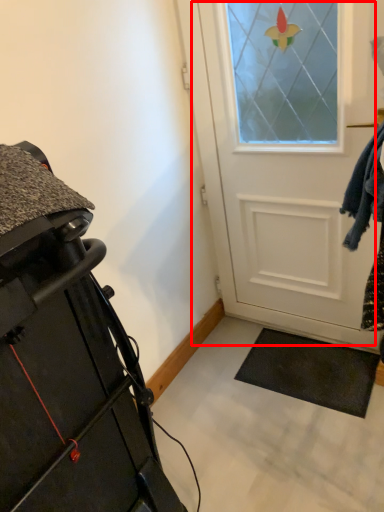
Question: From the image's perspective, where is door (annotated by the red box) located in relation to furniture in the image?

Choices:
 (A) below
 (B) above

Answer: (B)